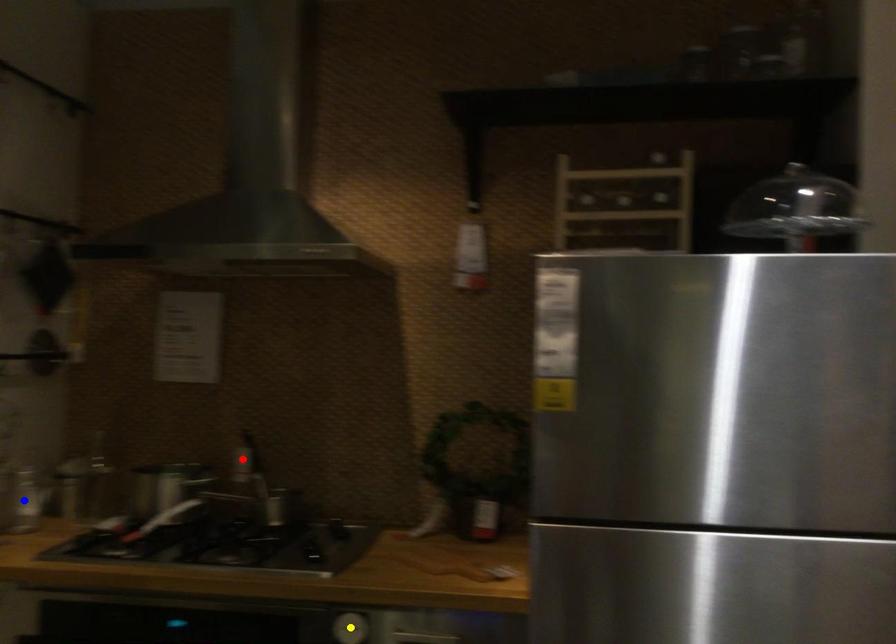
Order these from nearest to farthest:
1. yellow point
2. red point
3. blue point

red point
blue point
yellow point